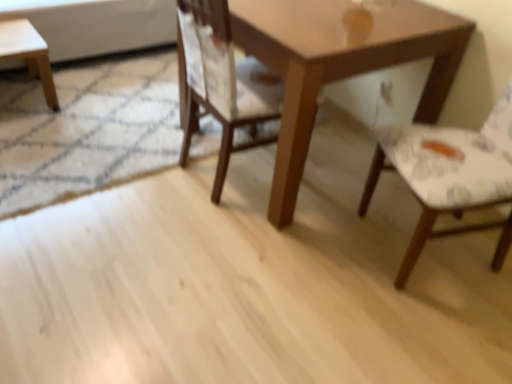
Find the location of a particular element. vacant space underneath white fabric chair at right, marked as the 2th chair in a left-to-right arrangement (from a real-world perspective) is located at coordinates (424, 243).